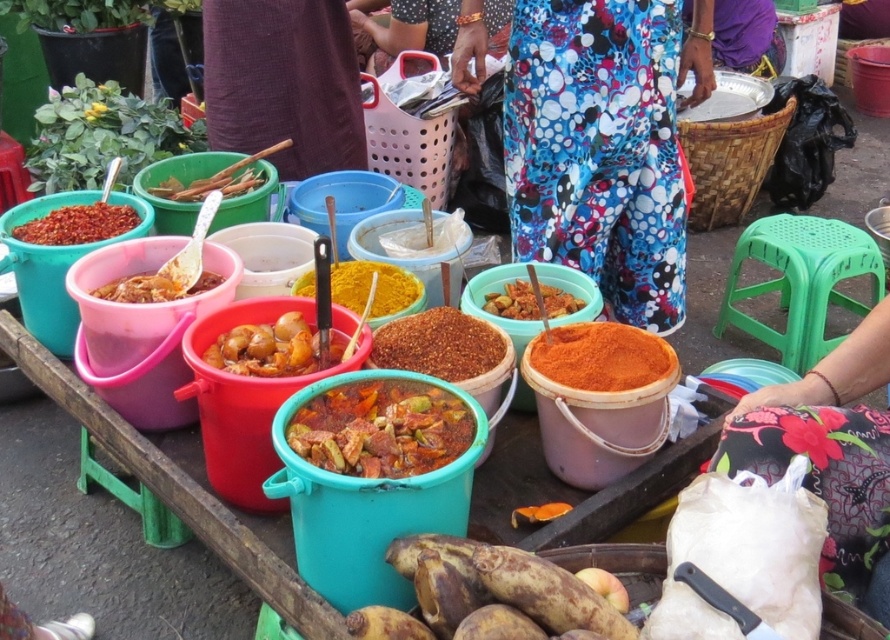
Question: Which object is the farthest from the floral fabric pants at center?

Choices:
 (A) bright yellow powder at center
 (B) orange powder spice at center

Answer: (A)

Question: Among these points, which one is farthest from the camera?

Choices:
 (A) (350, 467)
 (B) (587, 372)
 (C) (366, 296)

Answer: (C)

Question: In this image, where is brown fabric at upper center located relative to bright orange powder at center?

Choices:
 (A) above
 (B) below

Answer: (A)

Question: Does shiny red sauce at center have a smaller size compared to slightly translucent plastic bowl at left?

Choices:
 (A) no
 (B) yes

Answer: (A)

Question: Can you confirm if brown powder spice at center is positioned above bright red powder at center?

Choices:
 (A) yes
 (B) no

Answer: (B)

Question: Which of these objects is positioned farthest from the slightly translucent plastic bowl at left?

Choices:
 (A) brown powder spice at center
 (B) shiny red bucket at center

Answer: (A)